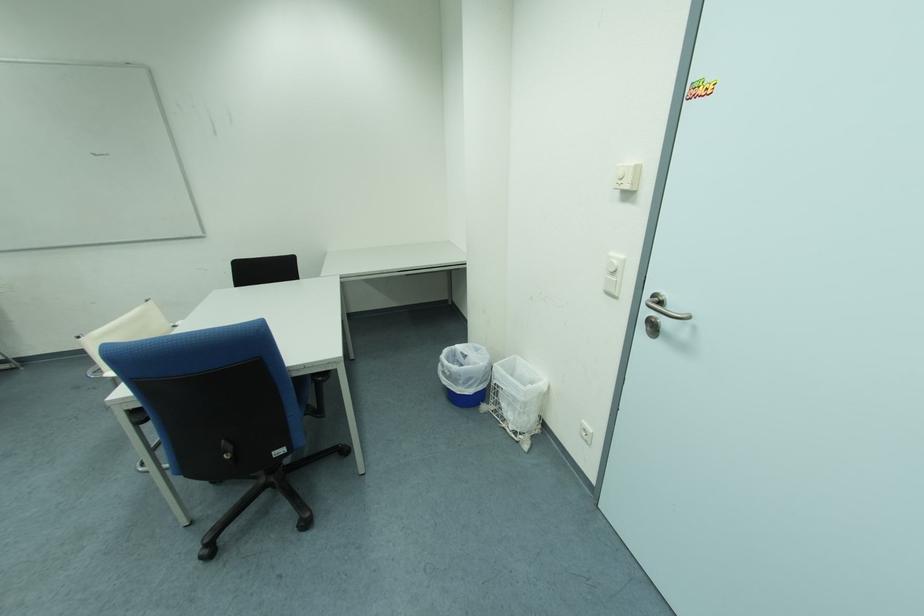
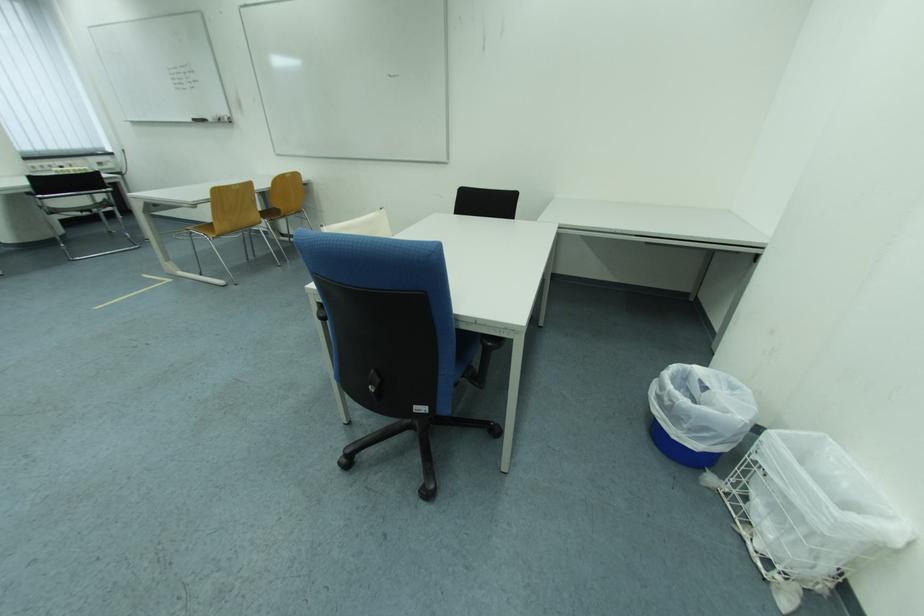
Question: How did the camera likely rotate?

Choices:
 (A) Left
 (B) Right
 (C) Up
 (D) Down

Answer: (A)